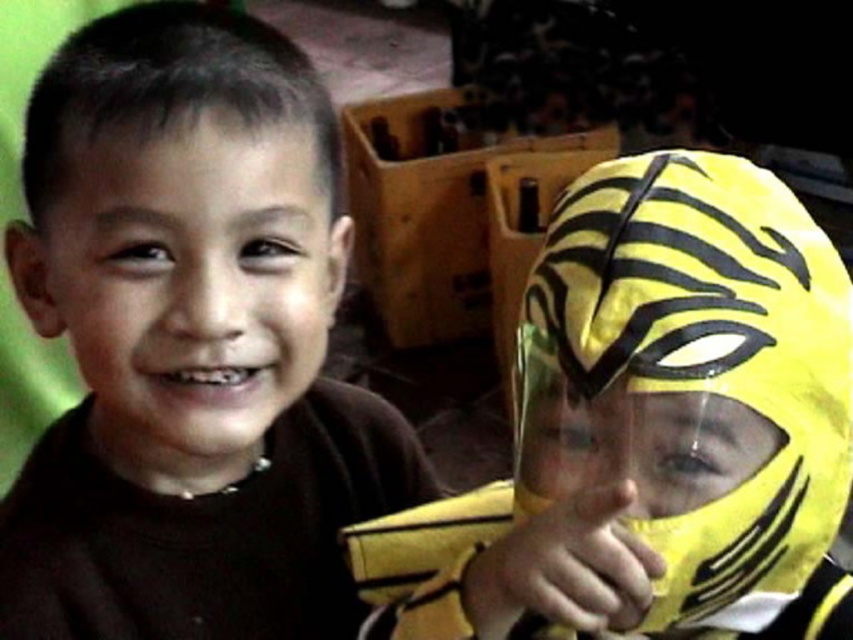
You are a costume designer who needs to ensure the yellow fabric mask at right doesn not cover the brown matte shirt at center. Based on the scene, will the mask be visible when worn?

The brown matte shirt at center is taller than the yellow fabric mask at right, so the mask will be visible when worn as it is shorter in height compared to the shirt.

In the scene shown: You are standing in the room and want to touch the point at coordinates (x=651, y=429). Which object from the following list will your hand land on? List the object exactly as described in the objects section. The objects are the yellow fabric mask at right and the wooden crate with toys.

The point at coordinates (x=651, y=429) is on the yellow fabric mask at right, so your hand will land on the yellow fabric mask at right.

You are a photographer setting up for a group photo. You have two subjects in front of you. The first is the matte brown face at left, and the second is the yellow fabric mask at right. Based on their sizes, which subject should you position closer to the camera to ensure both appear roughly the same size in the final photo?

Since the yellow fabric mask at right is bigger than the matte brown face at left, you should position the matte brown face at left closer to the camera to balance their sizes in the photo.